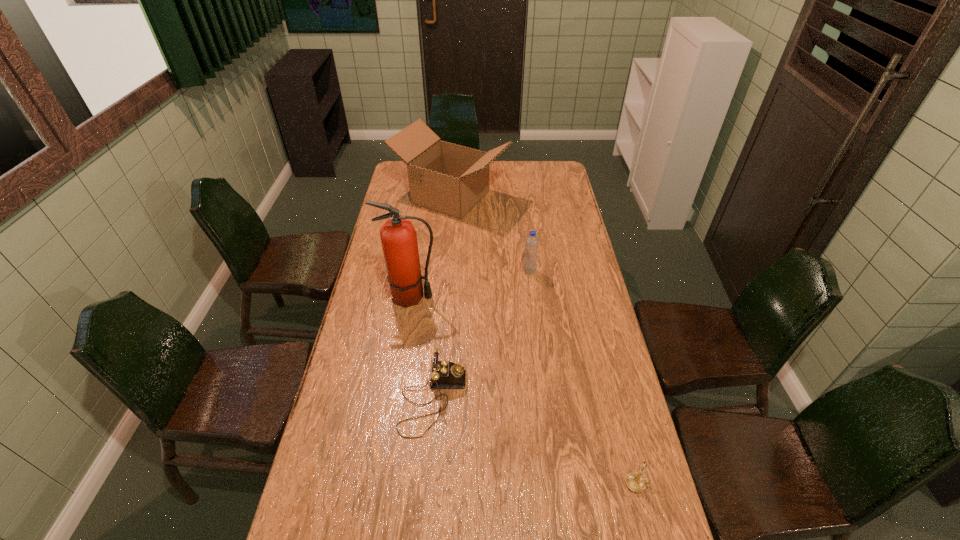
What are the coordinates of `empty space between the fourth object from left to right and the telephone` in the screenshot? It's located at (481, 335).

Find the location of `vacant region between the second farthest object and the third nearest object`. vacant region between the second farthest object and the third nearest object is located at coordinates (470, 284).

You are a GUI agent. You are given a task and a screenshot of the screen. Output one action in this format:
    pyautogui.click(x=<x>, y=<y>)
    Task: Click on the free space that is in between the third tallest object and the rightmost object
    Image resolution: width=960 pixels, height=540 pixels.
    Given the screenshot: What is the action you would take?
    pyautogui.click(x=584, y=377)

The height and width of the screenshot is (540, 960). In order to click on vacant region between the fourth object from left to right and the second nearest object in this screenshot , I will do `click(481, 335)`.

Identify the location of free point between the telephone and the third nearest object. point(422,348).

You are a GUI agent. You are given a task and a screenshot of the screen. Output one action in this format:
    pyautogui.click(x=<x>, y=<y>)
    Task: Click on the vacant region between the second farthest object and the fire extinguisher
    
    Given the screenshot: What is the action you would take?
    pyautogui.click(x=470, y=284)

Find the location of a particular element. unoccupied area between the rightmost object and the fourth object from left to right is located at coordinates (584, 377).

Where is `free spot between the water bottle and the telephone`? This screenshot has width=960, height=540. free spot between the water bottle and the telephone is located at coordinates (481, 335).

Where is `vacant area that lies between the tallest object and the candle holder`? This screenshot has width=960, height=540. vacant area that lies between the tallest object and the candle holder is located at coordinates (524, 390).

You are a GUI agent. You are given a task and a screenshot of the screen. Output one action in this format:
    pyautogui.click(x=<x>, y=<y>)
    Task: Click on the vacant space in between the nearest object and the second object from right to left
    
    Given the screenshot: What is the action you would take?
    pyautogui.click(x=584, y=377)